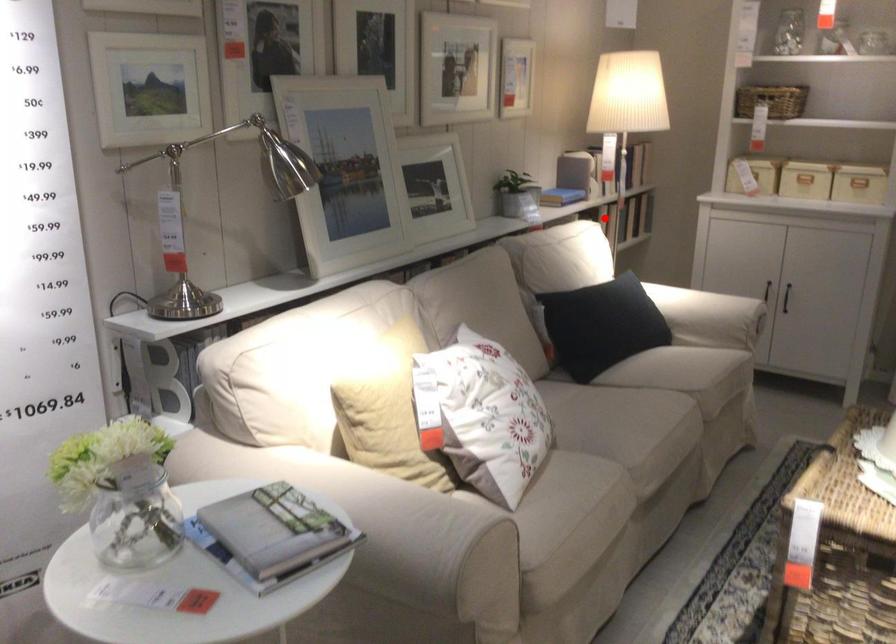
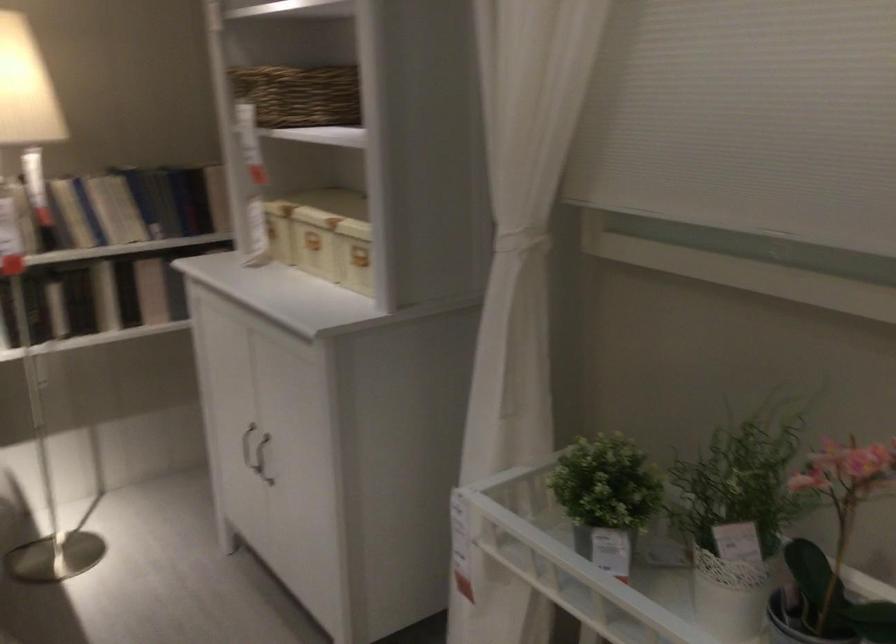
In the second image, find the point that corresponds to the highlighted location in the first image.

(55, 307)